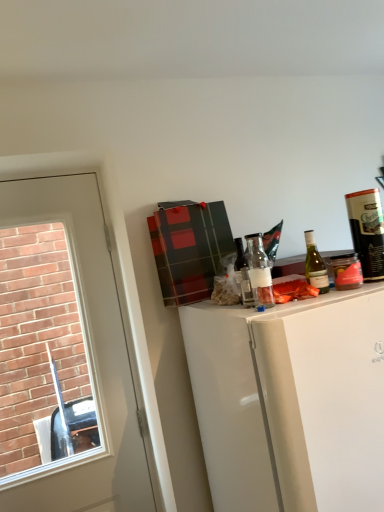
Question: Is matte black canister at upper right, acting as the first bottle starting from the right, in front of white glossy door at left?

Choices:
 (A) no
 (B) yes

Answer: (B)

Question: Is matte black canister at upper right, acting as the first bottle starting from the right, at the left side of white glossy door at left?

Choices:
 (A) yes
 (B) no

Answer: (B)

Question: From the image's perspective, is matte black canister at upper right, acting as the first bottle starting from the right, above white glossy door at left?

Choices:
 (A) no
 (B) yes

Answer: (B)

Question: Can you confirm if matte black canister at upper right, the 3th bottle when ordered from left to right, is wider than white glossy door at left?

Choices:
 (A) yes
 (B) no

Answer: (B)

Question: Is white glossy door at left at the back of matte black canister at upper right, the 3th bottle when ordered from left to right?

Choices:
 (A) yes
 (B) no

Answer: (B)

Question: From a real-world perspective, is matte black canister at upper right, acting as the first bottle starting from the right, below white glossy door at left?

Choices:
 (A) no
 (B) yes

Answer: (A)

Question: Is translucent glass bottle at center, which appears as the third bottle when viewed from the right, closer to camera compared to green glass bottle at upper right?

Choices:
 (A) no
 (B) yes

Answer: (A)

Question: Can you confirm if translucent glass bottle at center, the 1th bottle in the left-to-right sequence, is shorter than green glass bottle at upper right?

Choices:
 (A) no
 (B) yes

Answer: (A)

Question: Is translucent glass bottle at center, the 1th bottle in the left-to-right sequence, at the left side of green glass bottle at upper right?

Choices:
 (A) no
 (B) yes

Answer: (B)

Question: Is translucent glass bottle at center, the 1th bottle in the left-to-right sequence, taller than green glass bottle at upper right?

Choices:
 (A) no
 (B) yes

Answer: (B)

Question: From a real-world perspective, is translucent glass bottle at center, the 1th bottle in the left-to-right sequence, physically below green glass bottle at upper right?

Choices:
 (A) yes
 (B) no

Answer: (B)

Question: Is translucent glass bottle at center, which appears as the third bottle when viewed from the right, positioned with its back to green glass bottle at upper right?

Choices:
 (A) no
 (B) yes

Answer: (A)

Question: Is translucent glass bottle at center, the 1th bottle in the left-to-right sequence, wider than matte black canister at upper right, the 3th bottle when ordered from left to right?

Choices:
 (A) no
 (B) yes

Answer: (A)